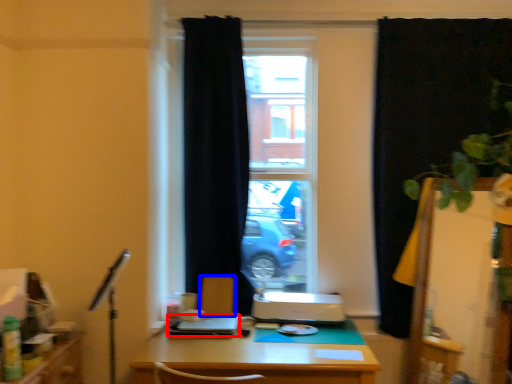
Question: Which of the following is the closest to the observer, laptop (highlighted by a red box) or armchair (highlighted by a blue box)?

Choices:
 (A) laptop
 (B) armchair

Answer: (A)